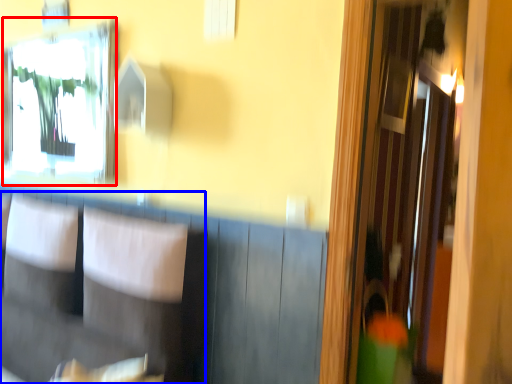
Question: Which of the following is the farthest to the observer, mirror (highlighted by a red box) or armchair (highlighted by a blue box)?

Choices:
 (A) mirror
 (B) armchair

Answer: (A)